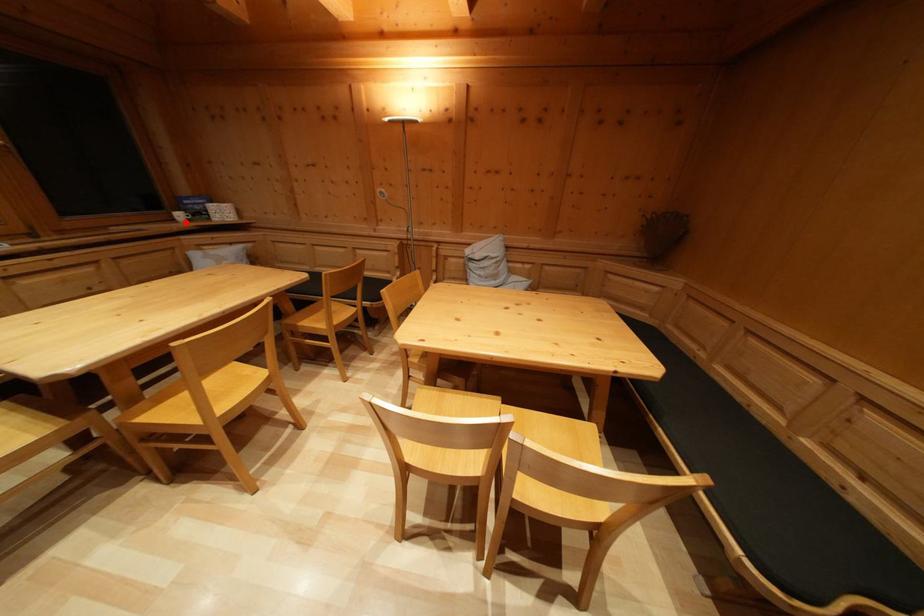
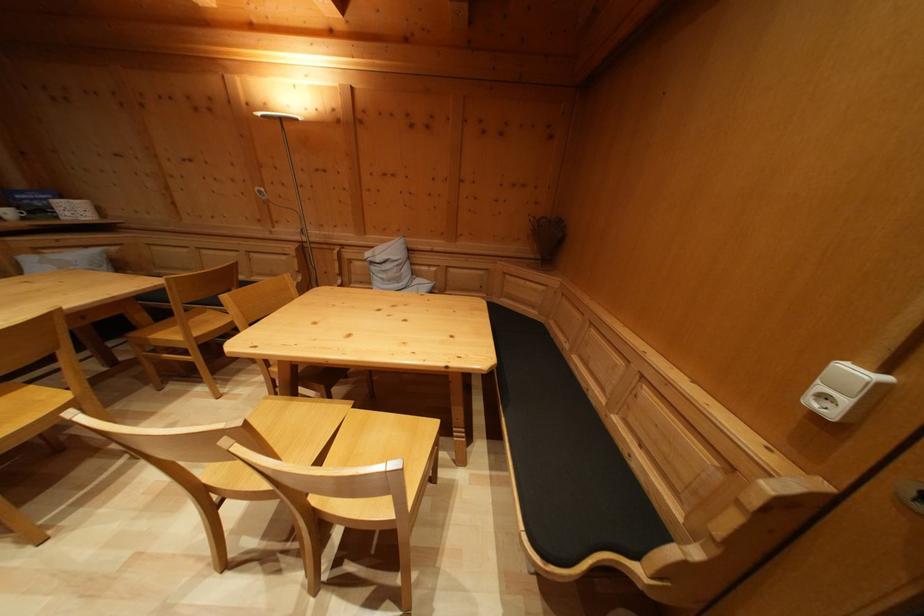
In the second image, find the point that corresponds to the highlighted location in the first image.

(14, 219)